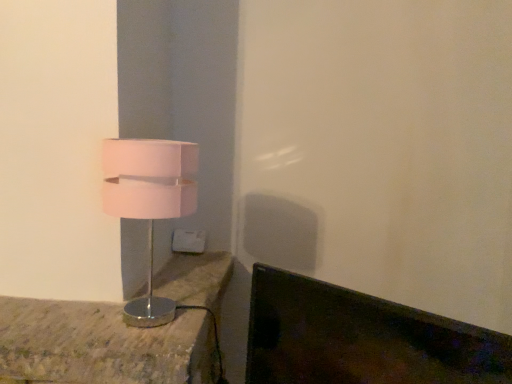
Locate an element on the screen. This screenshot has height=384, width=512. free space in front of white plastic electric outlet at center is located at coordinates (184, 269).